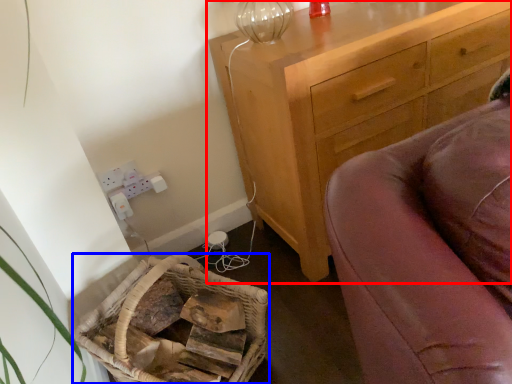
Question: Among these objects, which one is farthest to the camera, chest of drawers (highlighted by a red box) or basket (highlighted by a blue box)?

Choices:
 (A) chest of drawers
 (B) basket

Answer: (A)